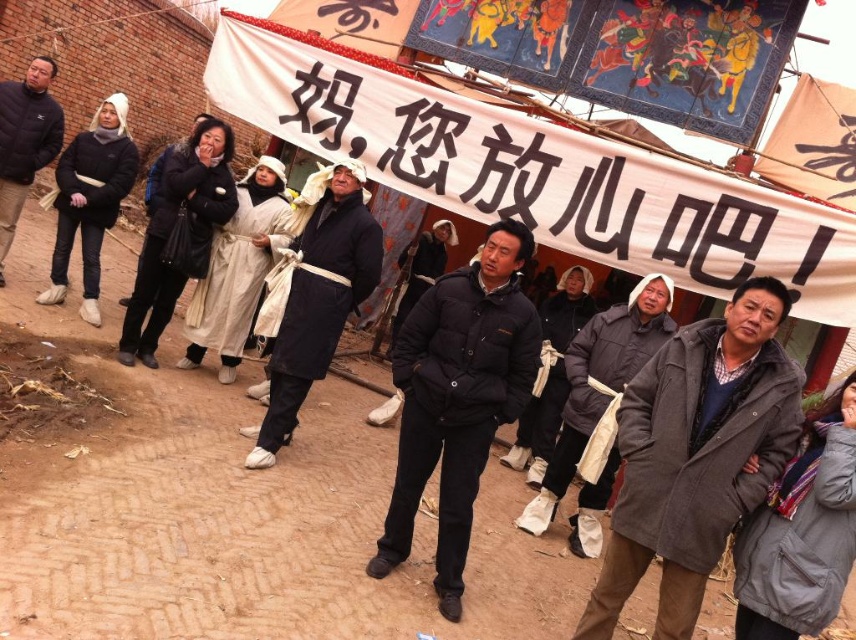
Which is below, beige woolen robe at center or dark gray puffy coat at center?

dark gray puffy coat at center is lower down.

Where is `beige woolen robe at center`? The width and height of the screenshot is (856, 640). beige woolen robe at center is located at coordinates (236, 269).

You are a GUI agent. You are given a task and a screenshot of the screen. Output one action in this format:
    pyautogui.click(x=<x>, y=<y>)
    Task: Click on the white paper banner at upper center
    This screenshot has height=640, width=856.
    Given the screenshot: What is the action you would take?
    pyautogui.click(x=538, y=173)

Can you confirm if white paper banner at upper center is positioned to the right of dark gray puffy coat at center?

In fact, white paper banner at upper center is to the left of dark gray puffy coat at center.

Does point (319, 68) lie behind point (538, 472)?

That is False.

You are a GUI agent. You are given a task and a screenshot of the screen. Output one action in this format:
    pyautogui.click(x=<x>, y=<y>)
    Task: Click on the white paper banner at upper center
    The height and width of the screenshot is (640, 856).
    Given the screenshot: What is the action you would take?
    pyautogui.click(x=538, y=173)

Does dark gray wool coat at center appear under beige woolen robe at center?

Yes.

Between dark gray wool coat at center and beige woolen robe at center, which one is positioned higher?

beige woolen robe at center

Which is behind, point (602, 365) or point (254, 189)?

Point (254, 189)

Identify the location of dark gray wool coat at center. (598, 406).